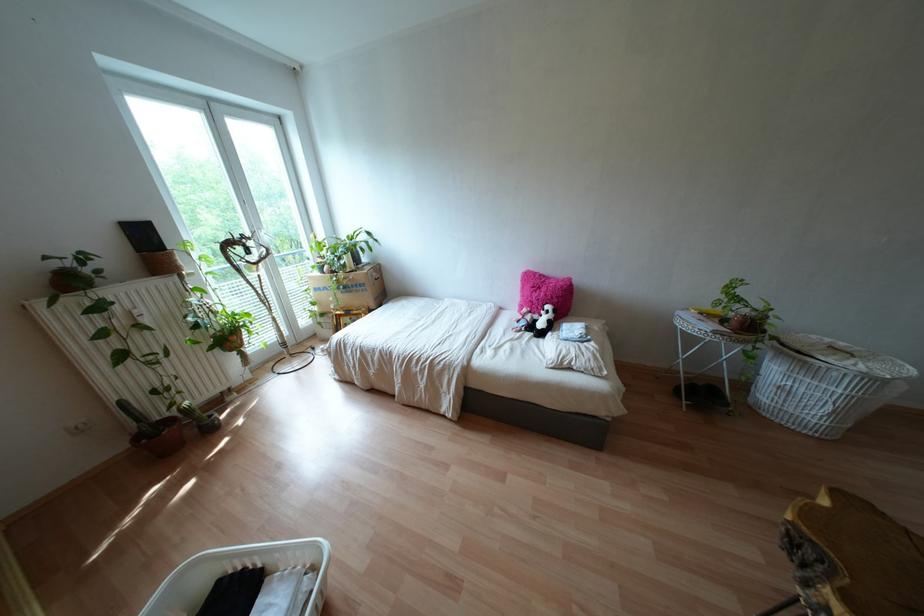
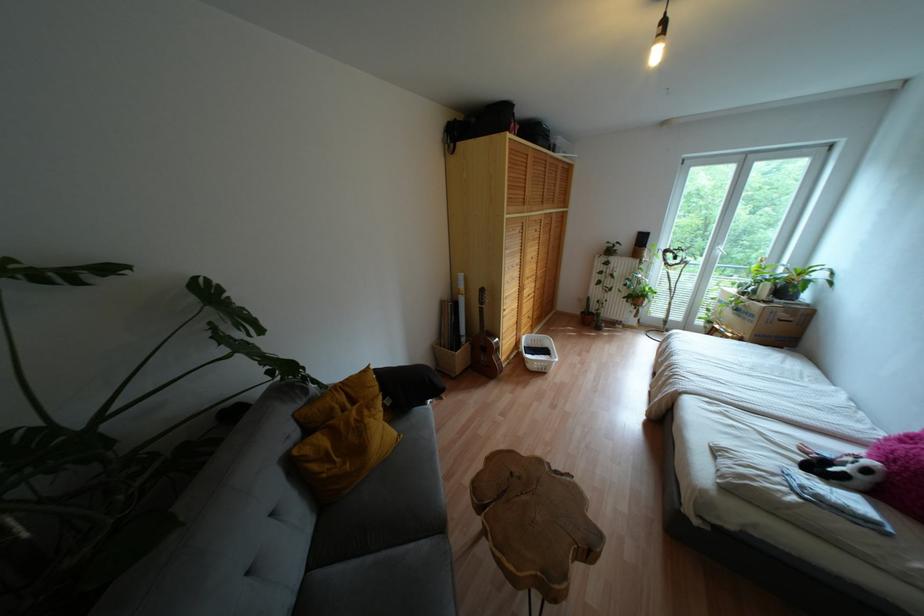
The point at (553,310) is marked in the first image. Where is the corresponding point in the second image?

(867, 471)